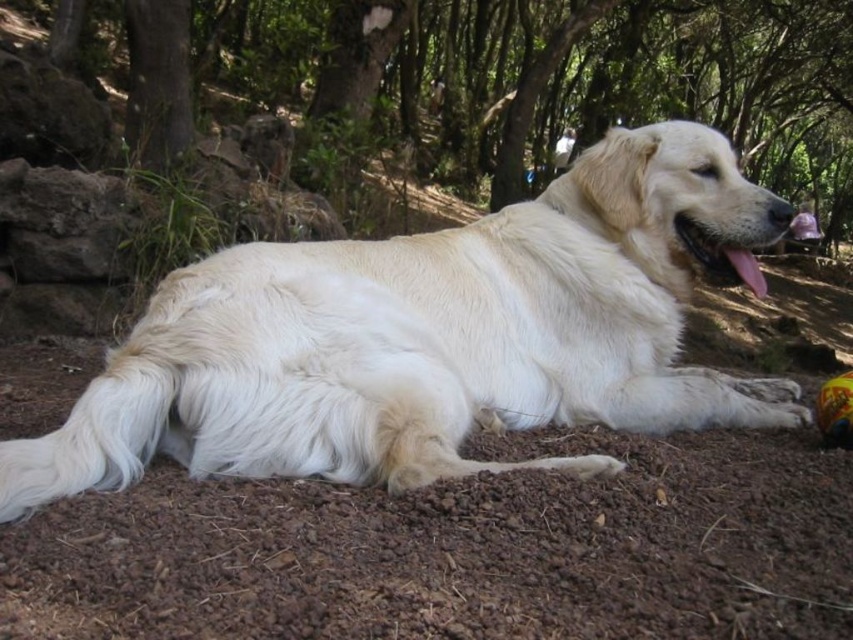
Question: Among these objects, which one is farthest from the camera?

Choices:
 (A) green leafy tree at upper center
 (B) white fluffy dog at center

Answer: (A)

Question: Does white fluffy dog at center appear on the right side of green leafy tree at upper center?

Choices:
 (A) no
 (B) yes

Answer: (A)

Question: Does white fluffy dog at center have a larger size compared to green leafy tree at upper center?

Choices:
 (A) no
 (B) yes

Answer: (A)

Question: Which of the following is the farthest from the observer?

Choices:
 (A) green leafy tree at upper center
 (B) white fluffy dog at center

Answer: (A)

Question: Observing the image, what is the correct spatial positioning of white fluffy dog at center in reference to green leafy tree at upper center?

Choices:
 (A) right
 (B) left

Answer: (B)